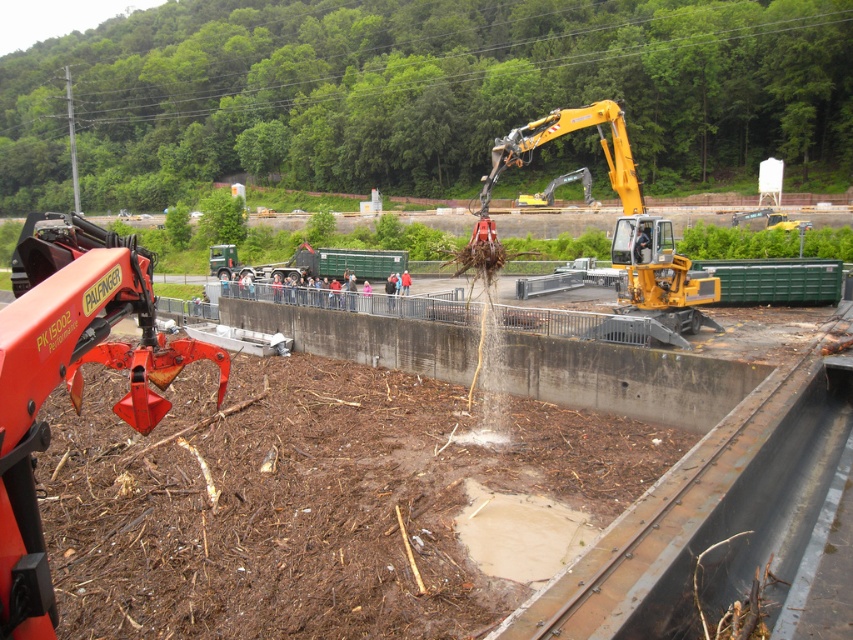
Question: Among these points, which one is farthest from the camera?

Choices:
 (A) (776, 385)
 (B) (645, 275)

Answer: (B)

Question: Is brown mulch at center wider than orange metallic claw at lower left?

Choices:
 (A) no
 (B) yes

Answer: (B)

Question: Is orange metallic claw at lower left smaller than yellow metallic excavator at center?

Choices:
 (A) no
 (B) yes

Answer: (B)

Question: Which object is positioned farthest from the orange metallic claw at lower left?

Choices:
 (A) brown mulch at center
 (B) yellow metallic excavator at center

Answer: (B)

Question: Is brown mulch at center closer to the viewer compared to yellow metallic excavator at center?

Choices:
 (A) no
 (B) yes

Answer: (B)

Question: Which object is the closest to the orange metallic claw at lower left?

Choices:
 (A) brown mulch at center
 (B) yellow metallic excavator at center

Answer: (A)